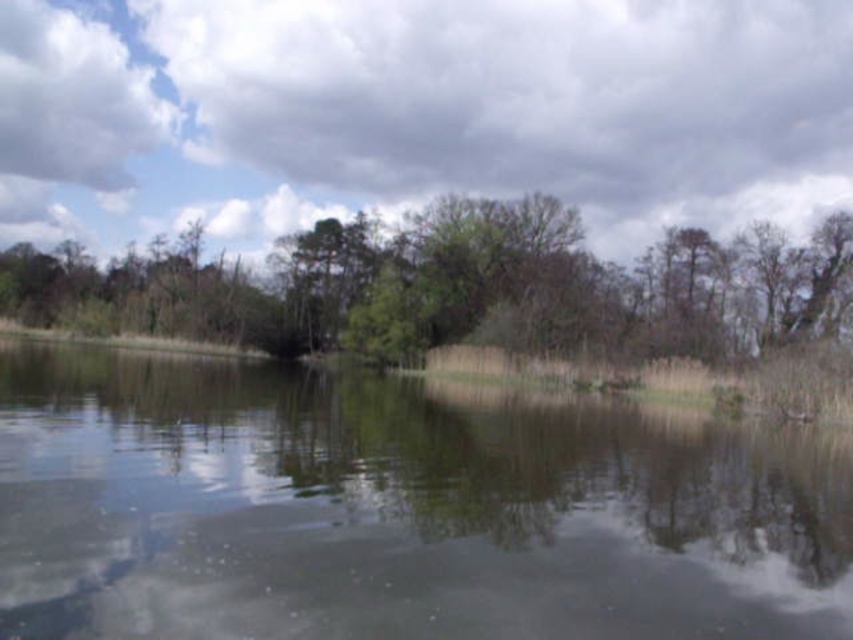
Who is higher up, clear water at center or green leafy tree at center?

green leafy tree at center is above.

Which is in front, point (322, 387) or point (408, 301)?

Point (322, 387) is in front.

Locate an element on the screen. The width and height of the screenshot is (853, 640). clear water at center is located at coordinates (398, 509).